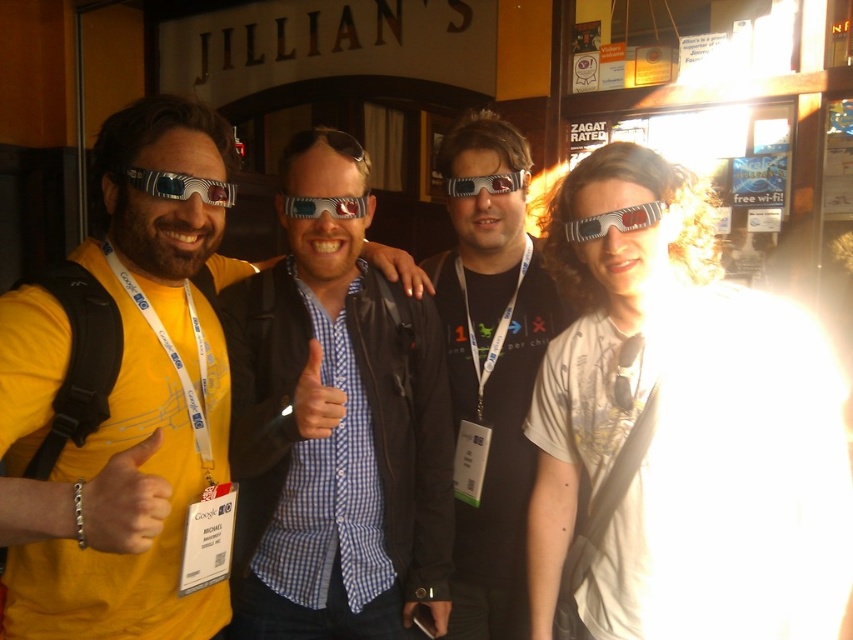
You are organizing a movie night and need to arrange items on a shelf. The checkered fabric thumb at center and the matte plastic 3d glasses at left must be placed side by side. Which item requires more horizontal space due to its greater width?

The matte plastic 3d glasses at left require more horizontal space because they have a greater width than the checkered fabric thumb at center.

You are a photographer trying to capture a closeup of the checkered fabric thumb at center and the matte plastic 3d glasses at left in the scene. Given that your camera has a maximum focus range of 16 inches, will you be able to focus on both objects simultaneously?

The checkered fabric thumb at center and matte plastic 3d glasses at left are 16.41 inches apart, which exceeds the camera maximum focus range of 16 inches. Therefore, you cannot focus on both objects simultaneously.